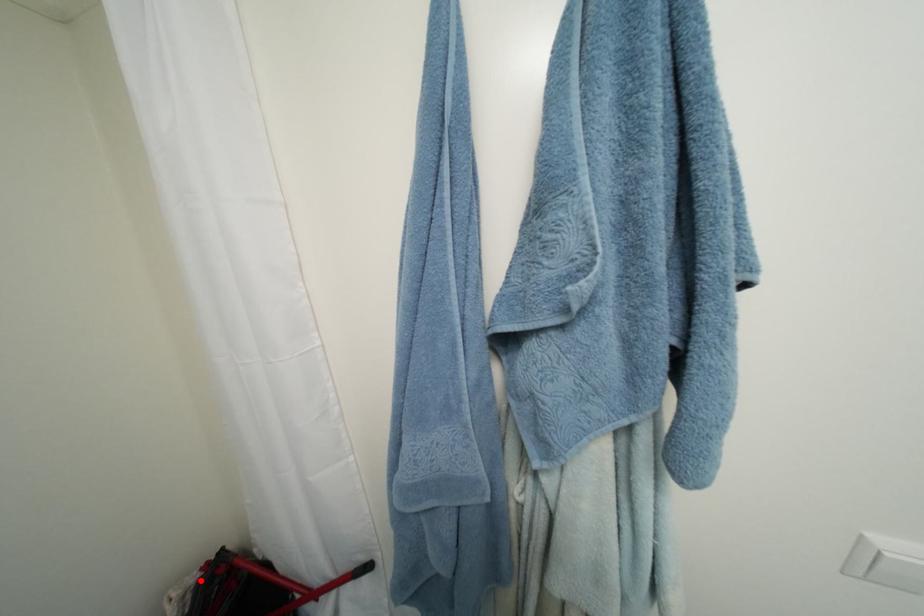
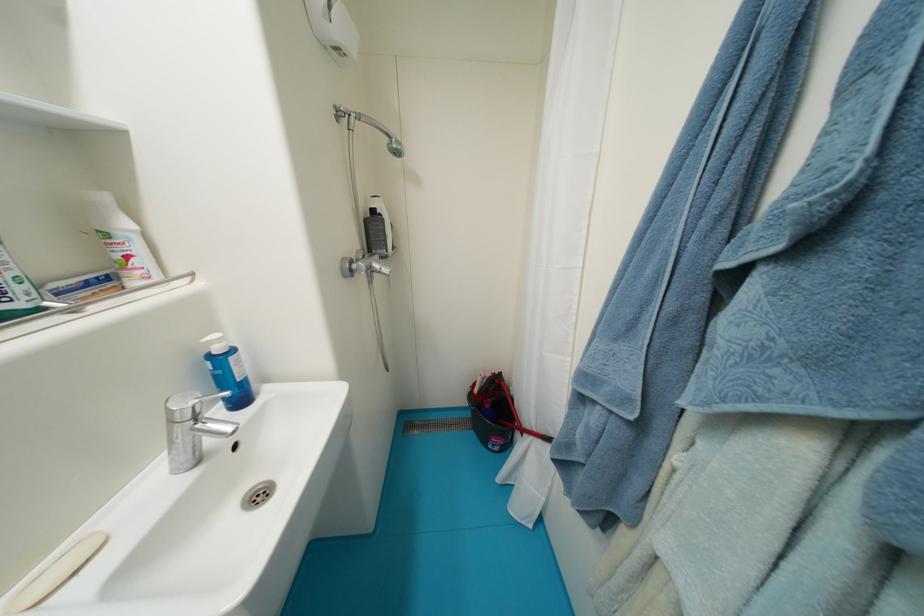
Where in the second image is the point corresponding to the highlighted location from the first image?

(495, 377)